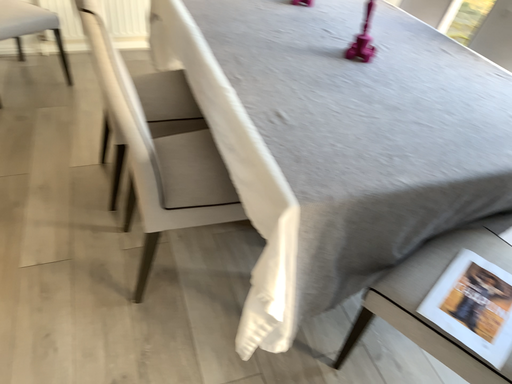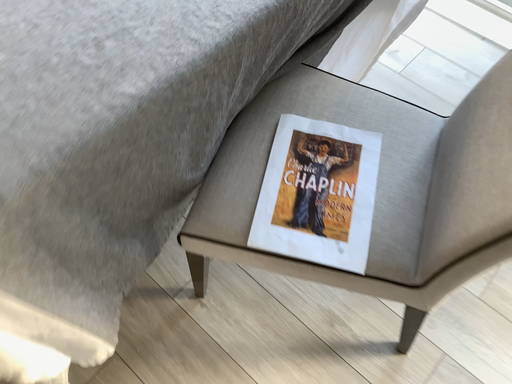
Question: How did the camera likely rotate when shooting the video?

Choices:
 (A) rotated right
 (B) rotated left

Answer: (A)